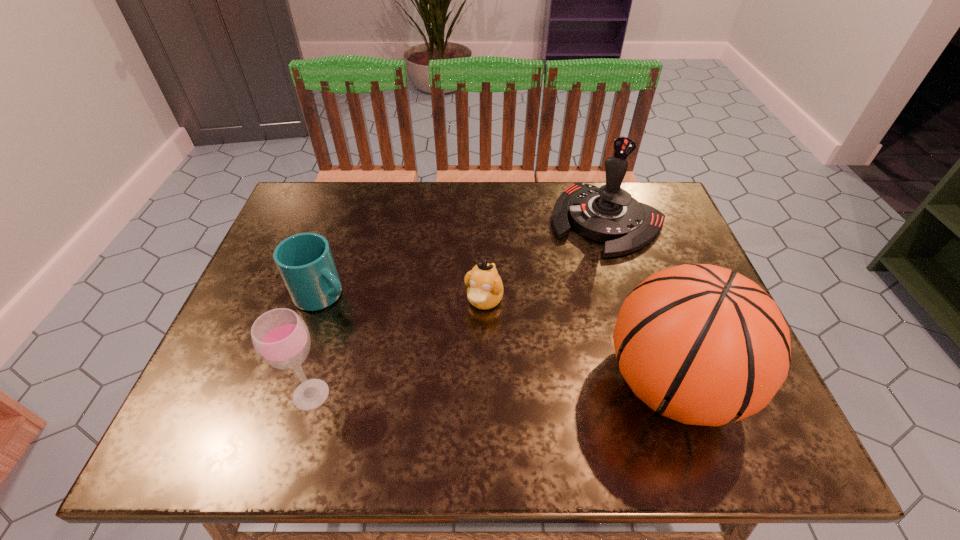
At what (x,y) coordinates should I click in order to perform the action: click on wineglass. Please return your answer as a coordinate pair (x, y). Looking at the image, I should click on (280, 337).

I want to click on basketball, so click(702, 345).

The width and height of the screenshot is (960, 540). Identify the location of the farthest object. (609, 214).

This screenshot has height=540, width=960. Identify the location of cup. (305, 262).

Identify the location of duckling. (485, 288).

Find the location of a particular element. free space located 0.390m on the back of the wineglass is located at coordinates (353, 249).

The width and height of the screenshot is (960, 540). Find the location of `free point located on the handle side of the farthest object`. free point located on the handle side of the farthest object is located at coordinates (521, 329).

Find the location of a particular element. free space located on the handle side of the farthest object is located at coordinates (514, 338).

Where is `vacant point located 0.110m on the handle side of the farthest object`? Image resolution: width=960 pixels, height=540 pixels. vacant point located 0.110m on the handle side of the farthest object is located at coordinates tap(564, 275).

At what (x,y) coordinates should I click in order to perform the action: click on vacant space located on the handle side of the cup. Please return your answer as a coordinate pair (x, y). Looking at the image, I should click on (420, 348).